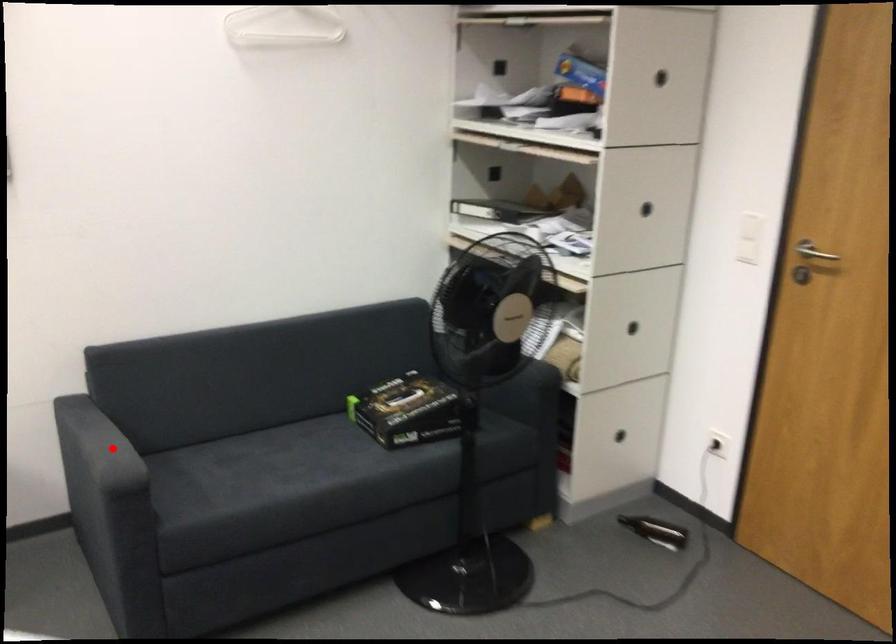
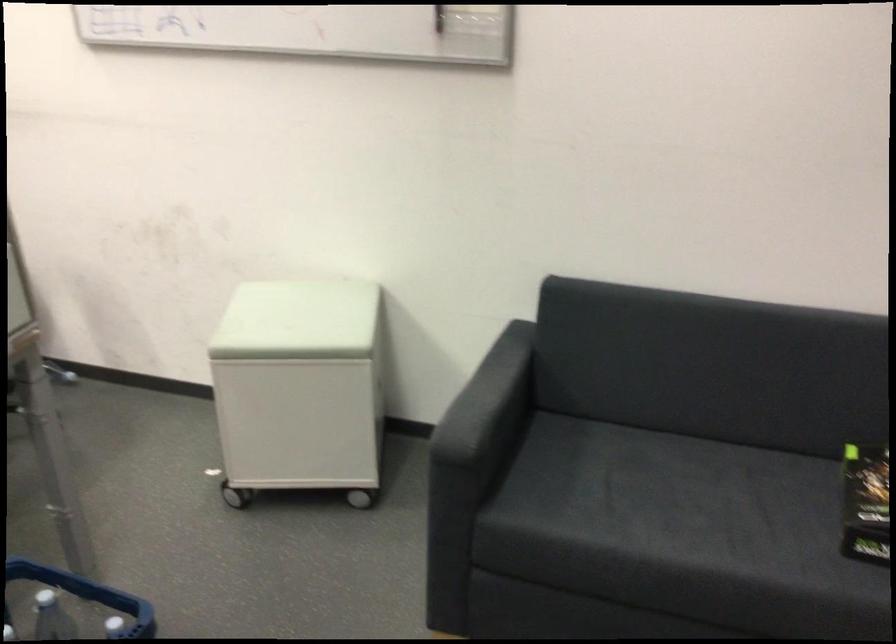
Question: I am providing you with two images of the same scene from different viewpoints. Image1 has a red point marked. In image2, the corresponding 3D location appears at what relative position? Reply with the corresponding letter.

Choices:
 (A) Closer
 (B) Farther

Answer: (A)